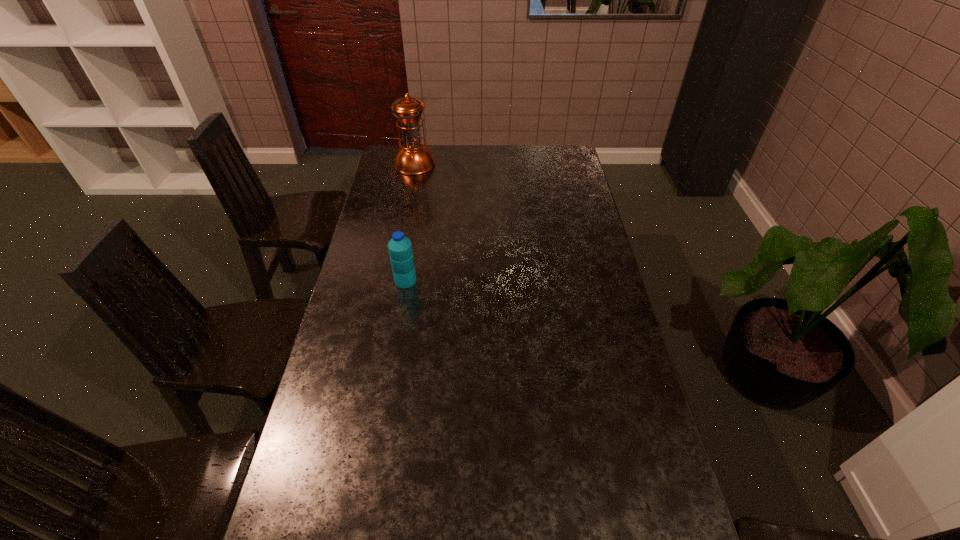
You are a GUI agent. You are given a task and a screenshot of the screen. Output one action in this format:
    pyautogui.click(x=<x>, y=<y>)
    Task: Click on the vacant space at the far edge
    This screenshot has width=960, height=540.
    Given the screenshot: What is the action you would take?
    [x=463, y=145]

The width and height of the screenshot is (960, 540). I want to click on free space at the left edge of the desktop, so click(388, 240).

You are a GUI agent. You are given a task and a screenshot of the screen. Output one action in this format:
    pyautogui.click(x=<x>, y=<y>)
    Task: Click on the free region at the right edge of the desktop
    
    Given the screenshot: What is the action you would take?
    pyautogui.click(x=624, y=340)

Find the location of a particular element. The image size is (960, 540). free space at the far right corner of the desktop is located at coordinates (569, 165).

The image size is (960, 540). What are the coordinates of `vacant area between the oil lamp and the nearer object` in the screenshot? It's located at (410, 222).

What are the coordinates of `free area in between the water bottle and the oil lamp` in the screenshot? It's located at (410, 222).

Find the location of a particular element. The width and height of the screenshot is (960, 540). free space between the shorter object and the taller object is located at coordinates (410, 222).

At what (x,y) coordinates should I click in order to perform the action: click on vacant region between the nearer object and the oil lamp. Please return your answer as a coordinate pair (x, y). The image size is (960, 540). Looking at the image, I should click on (410, 222).